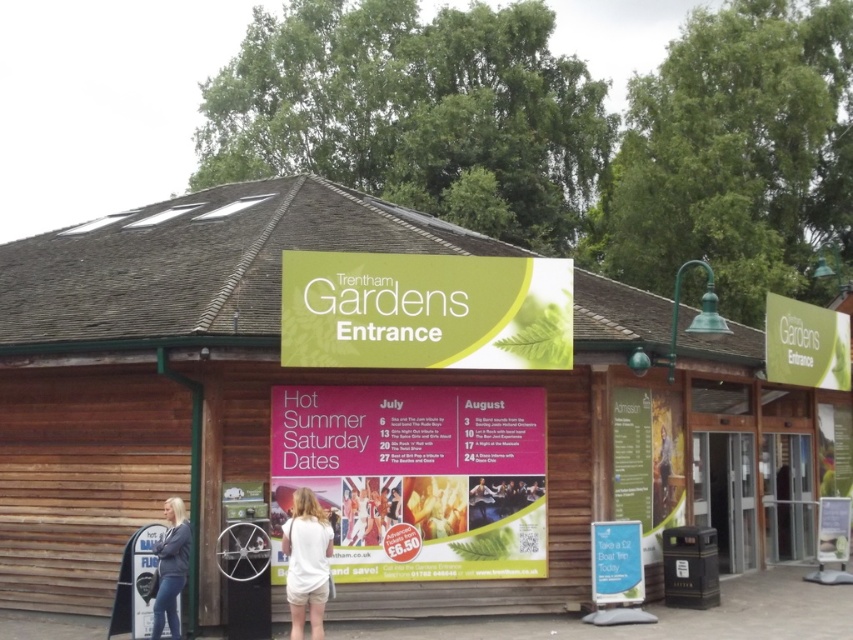
Between pink paper poster at center and white cotton shirt at center, which one is positioned higher?

pink paper poster at center is above.

The width and height of the screenshot is (853, 640). I want to click on pink paper poster at center, so click(x=415, y=476).

Is pink paper poster at center thinner than blonde hair at entrance?

Incorrect, pink paper poster at center's width is not less than blonde hair at entrance's.

Which is above, pink paper poster at center or blonde hair at entrance?

Positioned higher is pink paper poster at center.

Is point (520, 481) more distant than point (170, 504)?

Yes, it is behind point (170, 504).

Locate an element on the screen. This screenshot has width=853, height=640. pink paper poster at center is located at coordinates (415, 476).

Based on the photo, who is more forward, (x=444, y=333) or (x=828, y=323)?

Point (x=444, y=333)

Can you confirm if green matte sign at center is thinner than green matte sign at upper right?

Incorrect, green matte sign at center's width is not less than green matte sign at upper right's.

Is point (294, 252) more distant than point (843, 316)?

No, it is in front of (843, 316).

Locate an element on the screen. green matte sign at center is located at coordinates (425, 310).